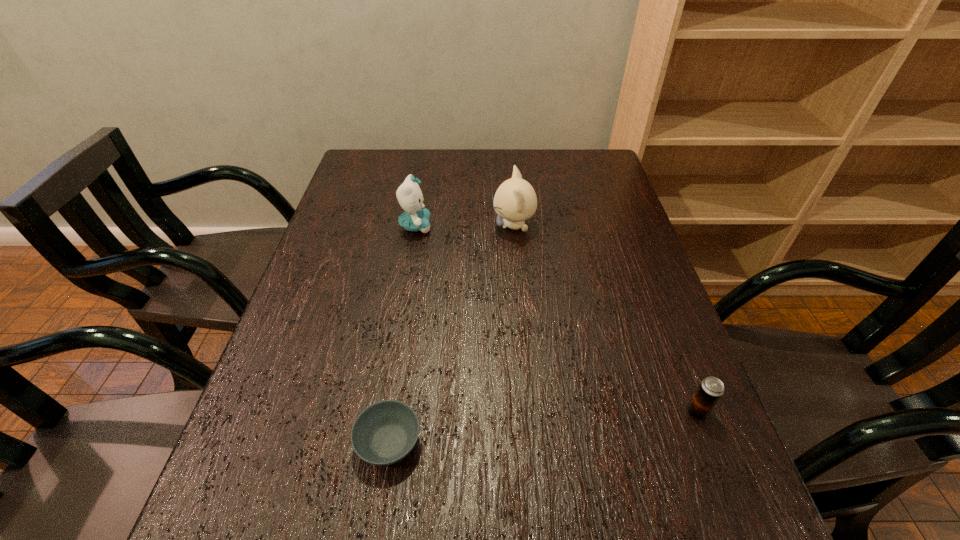
You are a GUI agent. You are given a task and a screenshot of the screen. Output one action in this format:
    pyautogui.click(x=<x>, y=<y>)
    Task: Click on the vacant region that satisfies the following two spatial constraints: 1. on the back side of the soup bowl; 2. on the right side of the second shortest object
    This screenshot has width=960, height=540.
    Given the screenshot: What is the action you would take?
    pyautogui.click(x=394, y=412)

Locate an element on the screen. This screenshot has height=540, width=960. free space in the image that satisfies the following two spatial constraints: 1. on the face of the beer can; 2. on the right side of the right kitten is located at coordinates (531, 412).

I want to click on free point that satisfies the following two spatial constraints: 1. on the face of the right kitten; 2. on the left side of the third tallest object, so click(x=531, y=412).

The image size is (960, 540). In order to click on free space that satisfies the following two spatial constraints: 1. on the face of the left kitten; 2. on the left side of the soup bowl in this screenshot , I will do `click(378, 442)`.

Image resolution: width=960 pixels, height=540 pixels. Identify the location of vacant space that satisfies the following two spatial constraints: 1. on the face of the left kitten; 2. on the right side of the shortest object. (378, 442).

This screenshot has height=540, width=960. Identify the location of vacant space that satisfies the following two spatial constraints: 1. on the face of the left kitten; 2. on the left side of the soup bowl. (378, 442).

Locate an element on the screen. free space that satisfies the following two spatial constraints: 1. on the face of the left kitten; 2. on the back side of the beer can is located at coordinates 384,412.

The image size is (960, 540). I want to click on free location that satisfies the following two spatial constraints: 1. on the face of the third object from left to right; 2. on the front side of the shortest object, so click(x=534, y=442).

Where is `vacant space that satisfies the following two spatial constraints: 1. on the face of the left kitten; 2. on the left side of the rightmost object`? Image resolution: width=960 pixels, height=540 pixels. vacant space that satisfies the following two spatial constraints: 1. on the face of the left kitten; 2. on the left side of the rightmost object is located at coordinates (384, 412).